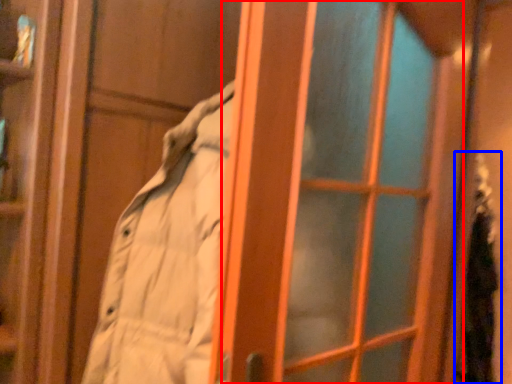
Question: Which object is closer to the camera taking this photo, screen door (highlighted by a red box) or person (highlighted by a blue box)?

Choices:
 (A) screen door
 (B) person

Answer: (A)